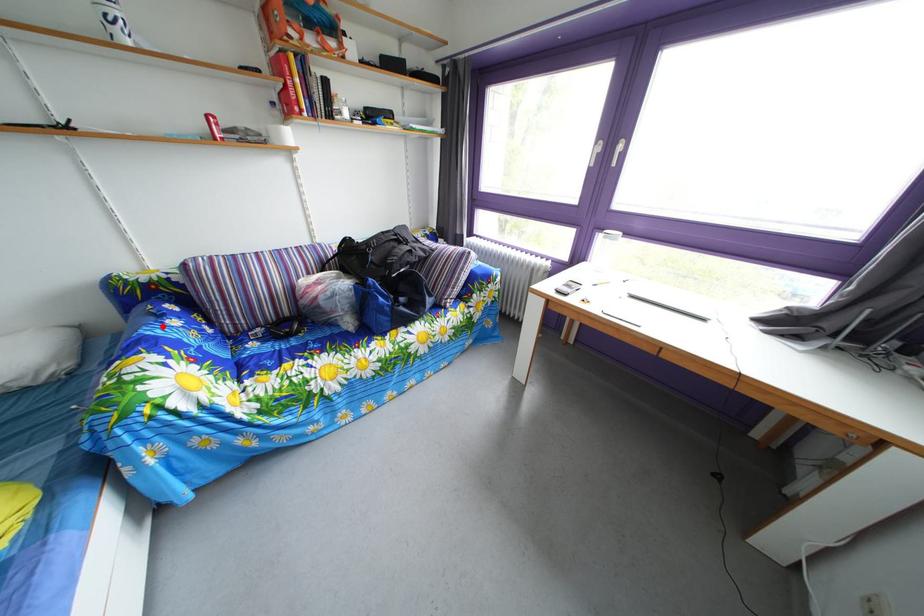
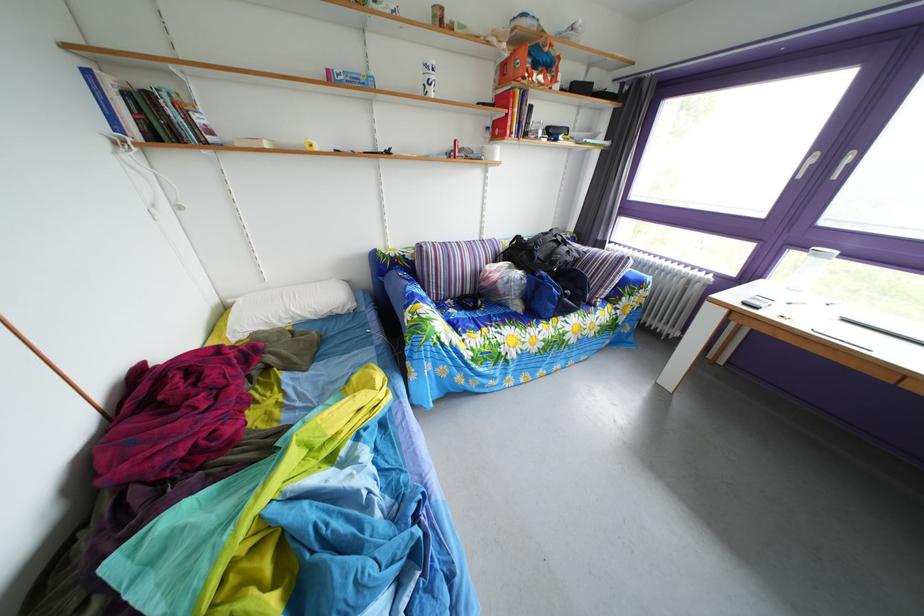
Question: I am providing you with two images of the same scene from different viewpoints. In image1, a red point is highlighted. Considering the same 3D point in image2, which of the following is correct?

Choices:
 (A) It is closer
 (B) It is farther

Answer: (A)